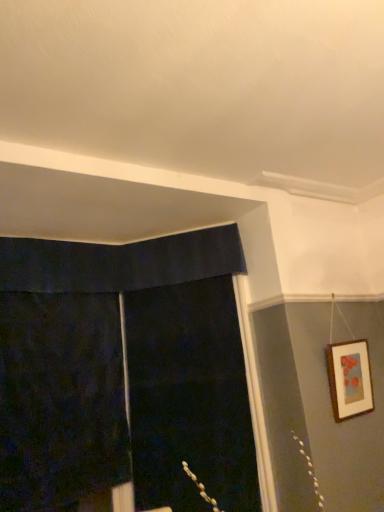
Question: Is wooden picture frame at upper right shorter than black fabric screen door at center?

Choices:
 (A) yes
 (B) no

Answer: (A)

Question: From a real-world perspective, is wooden picture frame at upper right physically above black fabric screen door at center?

Choices:
 (A) no
 (B) yes

Answer: (A)

Question: Considering the relative sizes of wooden picture frame at upper right and black fabric screen door at center in the image provided, is wooden picture frame at upper right bigger than black fabric screen door at center?

Choices:
 (A) no
 (B) yes

Answer: (A)

Question: From a real-world perspective, is wooden picture frame at upper right positioned under black fabric screen door at center based on gravity?

Choices:
 (A) no
 (B) yes

Answer: (B)

Question: Can you confirm if wooden picture frame at upper right is positioned to the right of black fabric screen door at center?

Choices:
 (A) no
 (B) yes

Answer: (B)

Question: From a real-world perspective, is wooden picture frame at upper right physically located above or below dark velvet curtain at left?

Choices:
 (A) below
 (B) above

Answer: (A)

Question: Choose the correct answer: Is wooden picture frame at upper right inside dark velvet curtain at left or outside it?

Choices:
 (A) outside
 (B) inside

Answer: (A)

Question: In terms of width, does wooden picture frame at upper right look wider or thinner when compared to dark velvet curtain at left?

Choices:
 (A) wide
 (B) thin

Answer: (B)

Question: From the image's perspective, is wooden picture frame at upper right positioned above or below dark velvet curtain at left?

Choices:
 (A) above
 (B) below

Answer: (A)

Question: From the image's perspective, is wooden picture frame at upper right above or below black fabric screen door at center?

Choices:
 (A) above
 (B) below

Answer: (A)

Question: From a real-world perspective, is wooden picture frame at upper right physically located above or below black fabric screen door at center?

Choices:
 (A) above
 (B) below

Answer: (B)

Question: Is wooden picture frame at upper right bigger or smaller than black fabric screen door at center?

Choices:
 (A) small
 (B) big

Answer: (A)

Question: In terms of width, does wooden picture frame at upper right look wider or thinner when compared to black fabric screen door at center?

Choices:
 (A) thin
 (B) wide

Answer: (A)

Question: In the image, is black fabric screen door at center positioned in front of or behind wooden picture frame at upper right?

Choices:
 (A) behind
 (B) front

Answer: (A)

Question: Is black fabric screen door at center taller or shorter than wooden picture frame at upper right?

Choices:
 (A) tall
 (B) short

Answer: (A)